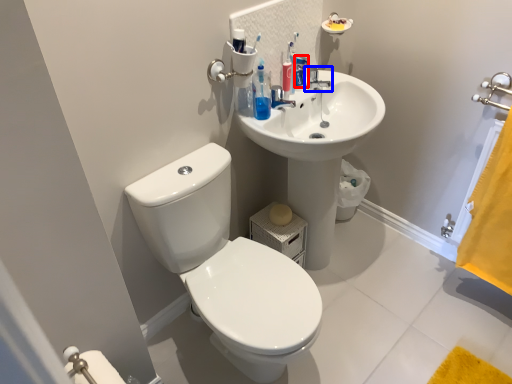
Question: Which point is further to the camera, toiletry (highlighted by a red box) or tap (highlighted by a blue box)?

Choices:
 (A) toiletry
 (B) tap

Answer: (B)